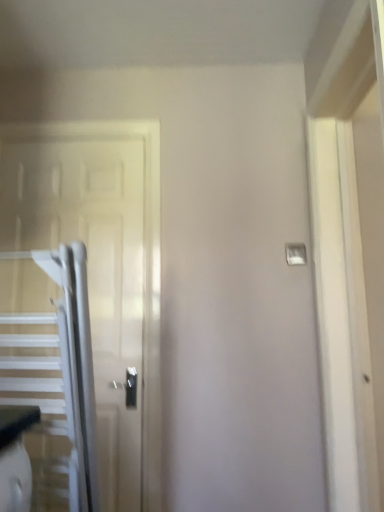
This screenshot has height=512, width=384. What do you see at coordinates (92, 272) in the screenshot?
I see `matte white door at left` at bounding box center [92, 272].

At what (x,y) coordinates should I click in order to perform the action: click on matte white door at left. Please return your answer as a coordinate pair (x, y). The height and width of the screenshot is (512, 384). Looking at the image, I should click on (92, 272).

This screenshot has height=512, width=384. I want to click on matte white door at left, so click(92, 272).